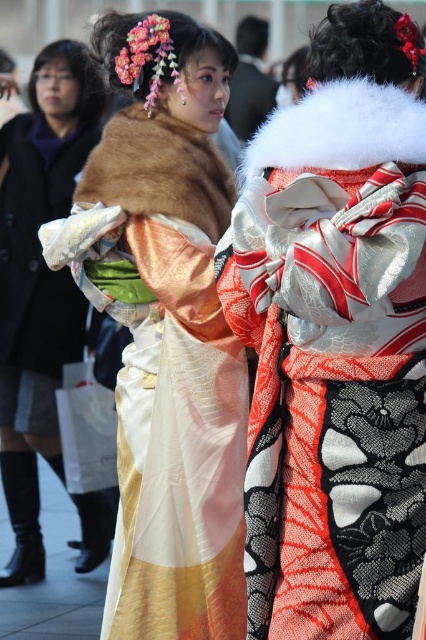
You are an artist trying to sketch the scene. Where exactly should you place the silky kimono at center in terms of coordinates?

The silky kimono at center should be placed at coordinates point (336, 337).